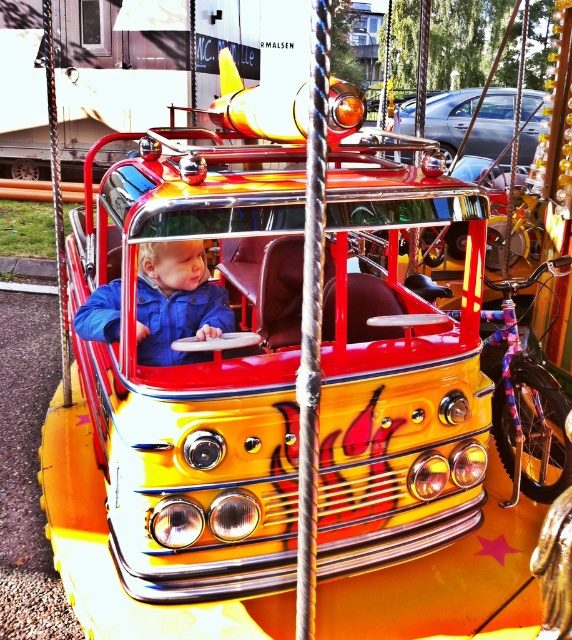
You are a photographer at the fairground. You want to take a photo of the blue fleece jacket at center and the metallic silver car at upper center such that the jacket appears to the left of the car. Is this possible based on their current positions?

Yes, because the blue fleece jacket at center is positioned on the left side of metallic silver car at upper center, so arranging them in the photo to show the jacket on the left of the car is feasible.

You are a photographer trying to capture the perfect shot of the blue fleece jacket at center. The fairground is crowded, and you can only take a photo from the front of the fire truck ride. Based on the jacket location, where should you position your camera to ensure the jacket is centered in the frame?

The blue fleece jacket at center is located at coordinates 0.473 on the x axis and 0.309 on the y axis. To center the jacket in the frame, position the camera so that the crosshairs align with these coordinates, ensuring the jacket is at the center of the image.